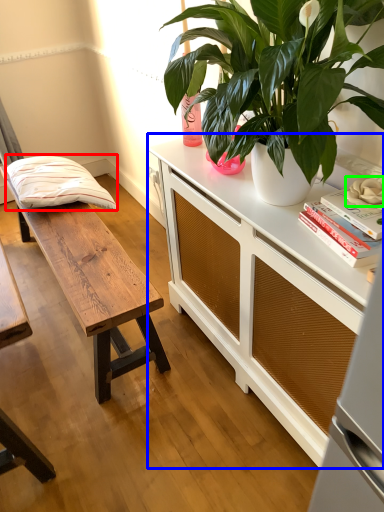
Question: Which is nearer to the pillow (highlighted by a red box)? cabinetry (highlighted by a blue box) or flower (highlighted by a green box).

Choices:
 (A) cabinetry
 (B) flower

Answer: (A)